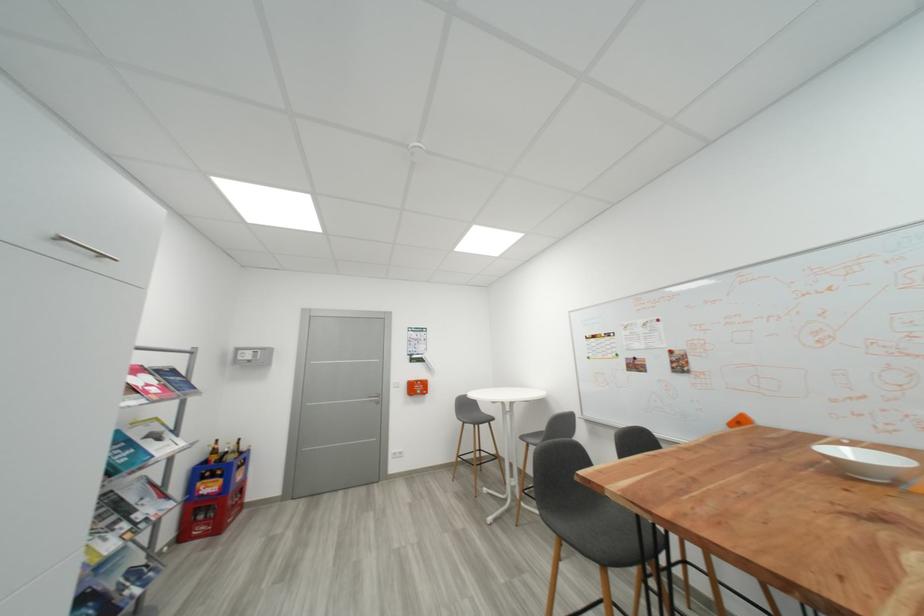
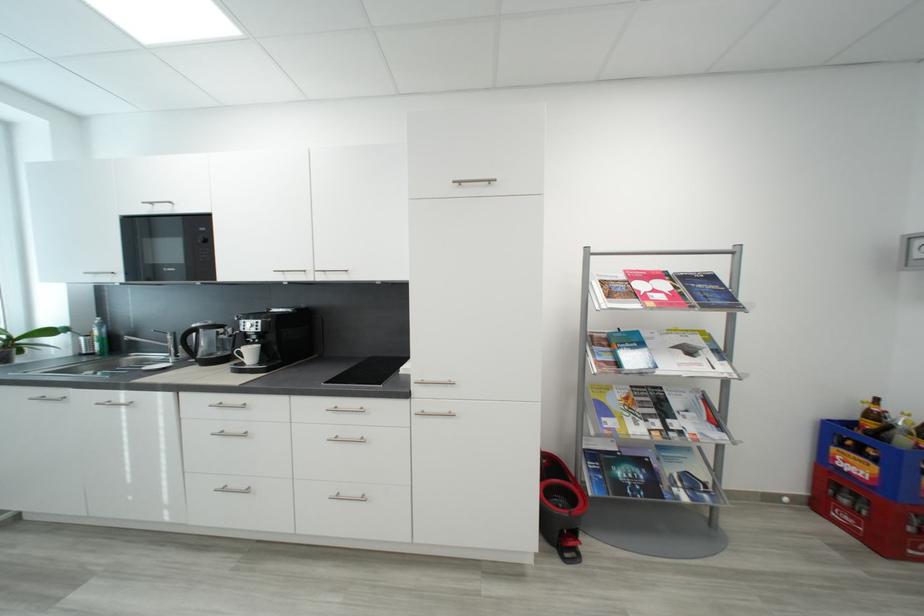
The point at (139, 499) is marked in the first image. Where is the corresponding point in the second image?

(684, 406)